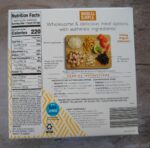
I want to click on black circle on lower right corner of cutting board, so click(x=104, y=59).